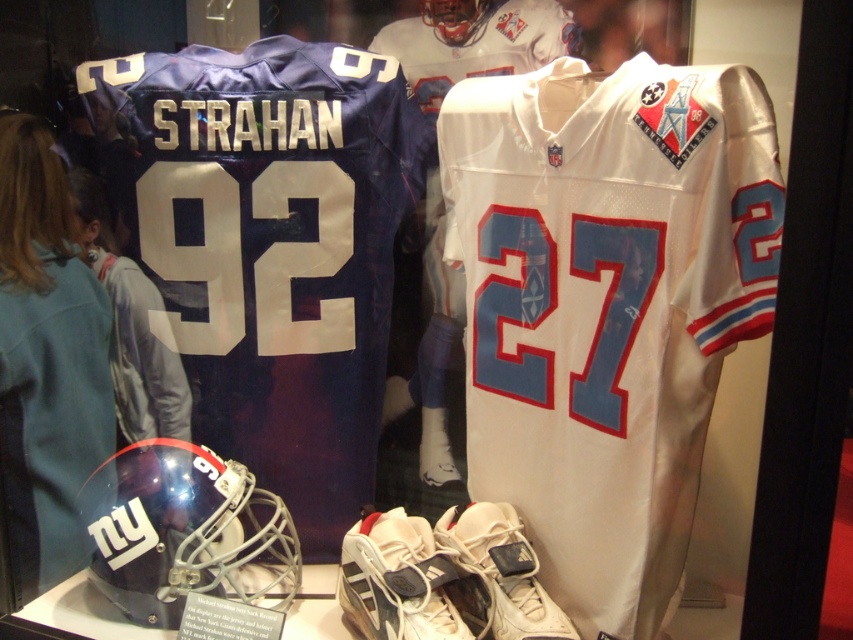
You are standing in front of the display case and want to take a photo of both points. Which point, point (585,225) or point (433,602), will appear larger in your camera view?

Point (585,225) is closer to the camera than point (433,602), so it will appear larger in the camera view.

You are a visitor standing in front of the display case. You see the white leather shoe at lower center and the matte blue jersey at upper left. Which object is positioned to the right side of the other?

The white leather shoe at lower center is to the right of the matte blue jersey at upper left according to the description.

You are a museum curator arranging items in a display case. You need to ensure that the white mesh jersey at center and the white leather shoe at center are visible to visitors standing directly in front of the case. Based on their sizes, which item will appear larger to visitors?

The white mesh jersey at center is taller than the white leather shoe at center, so it will appear larger to visitors standing directly in front of the case.